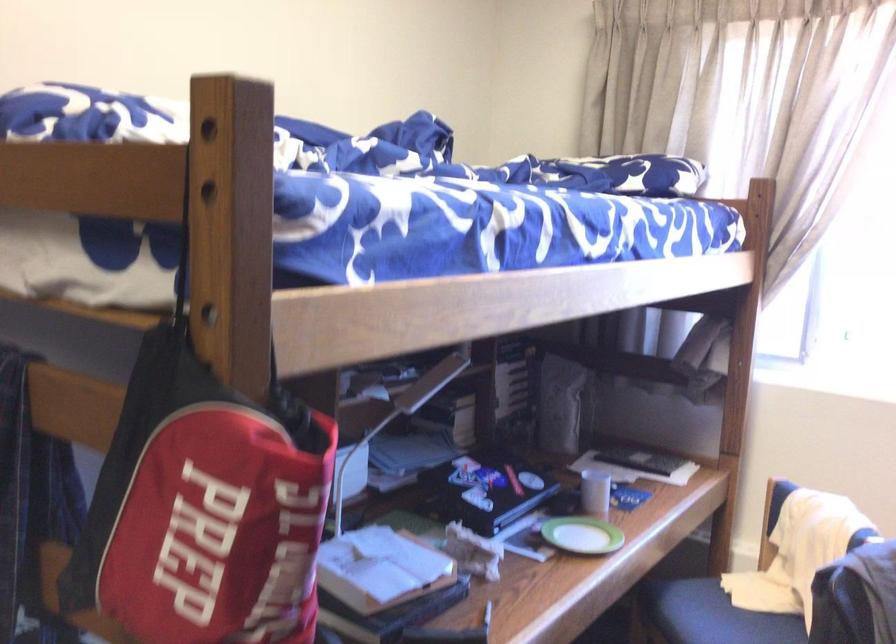
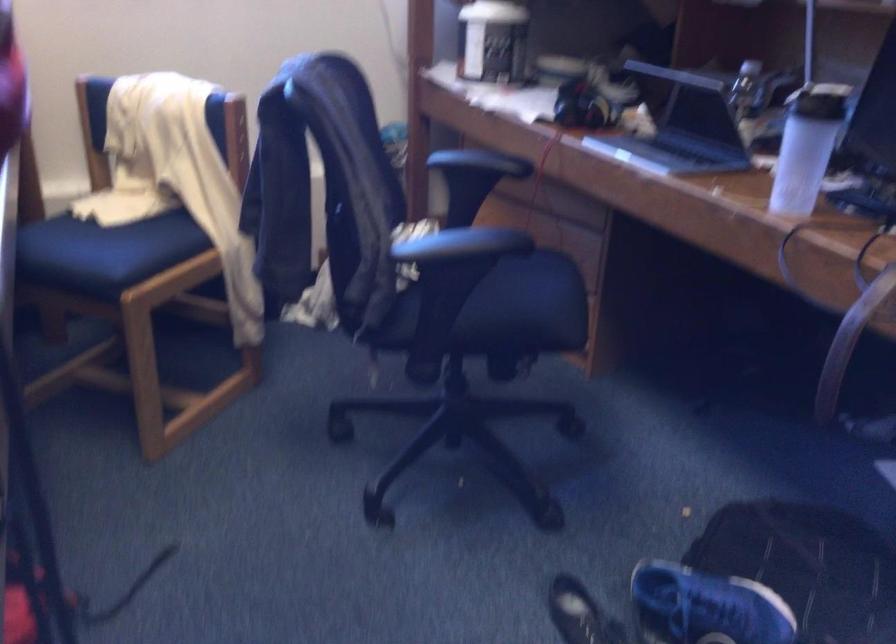
The first image is from the beginning of the video and the second image is from the end. How did the camera likely rotate when shooting the video?

The camera's rotation is toward right-down.